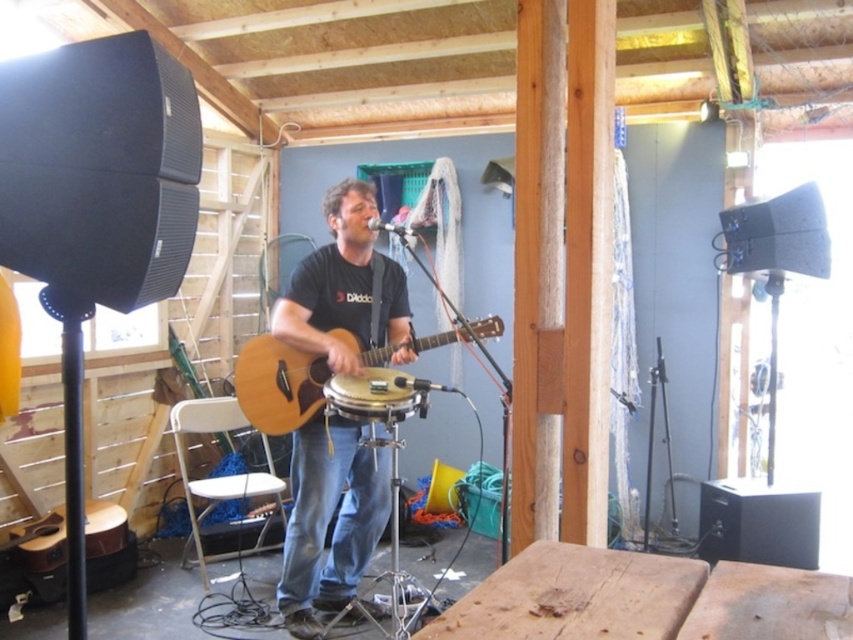
Can you confirm if matte black guitar at center is positioned below natural wood acoustic guitar at center?

Yes.

Can you confirm if matte black guitar at center is positioned above natural wood acoustic guitar at center?

No, matte black guitar at center is not above natural wood acoustic guitar at center.

Where is `matte black guitar at center`? The height and width of the screenshot is (640, 853). matte black guitar at center is located at coordinates (329, 520).

Image resolution: width=853 pixels, height=640 pixels. In order to click on matte black guitar at center in this screenshot , I will do `click(329, 520)`.

Is natural wood acoustic guitar at center shorter than matte black drum at center?

Incorrect, natural wood acoustic guitar at center's height does not fall short of matte black drum at center's.

Is natural wood acoustic guitar at center positioned at the back of matte black drum at center?

Yes, natural wood acoustic guitar at center is behind matte black drum at center.

Is point (286, 356) positioned before point (403, 387)?

No, it is behind (403, 387).

Identify the location of natural wood acoustic guitar at center. (277, 385).

Can you confirm if matte black guitar at center is taller than matte black drum at center?

Indeed, matte black guitar at center has a greater height compared to matte black drum at center.

Can you confirm if matte black guitar at center is smaller than matte black drum at center?

Incorrect, matte black guitar at center is not smaller in size than matte black drum at center.

Describe the element at coordinates (329, 520) in the screenshot. The width and height of the screenshot is (853, 640). I see `matte black guitar at center` at that location.

Where is `matte black guitar at center`? This screenshot has width=853, height=640. matte black guitar at center is located at coordinates (329, 520).